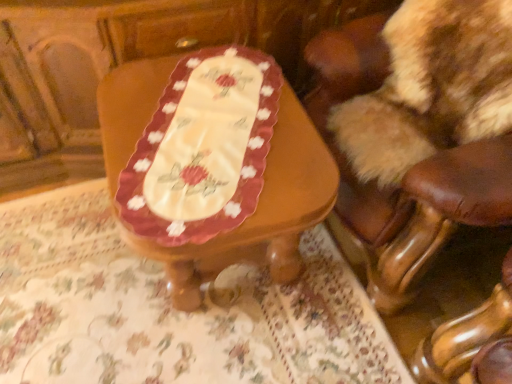
This screenshot has height=384, width=512. In order to click on wooden table at center in this screenshot , I will do `click(213, 165)`.

What do you see at coordinates (170, 309) in the screenshot?
I see `beige fabric tablecloth at center` at bounding box center [170, 309].

Identify the location of brown leather chair at upper right. [407, 119].

From the picture: From a real-world perspective, who is located higher, wooden table at center or brown leather chair at upper right?

brown leather chair at upper right.

From the image's perspective, is wooden table at center located beneath brown leather chair at upper right?

Yes, from the image's perspective, wooden table at center is beneath brown leather chair at upper right.

Consider the image. Is wooden table at center turned away from brown leather chair at upper right?

That's right, wooden table at center is facing away from brown leather chair at upper right.

Would you say wooden table at center is inside or outside brown leather chair at upper right?

wooden table at center lies outside brown leather chair at upper right.

Is wooden table at center facing away from beige fabric tablecloth at center?

No.

Is the depth of wooden table at center greater than that of beige fabric tablecloth at center?

No.

Is wooden table at center smaller than beige fabric tablecloth at center?

Incorrect, wooden table at center is not smaller in size than beige fabric tablecloth at center.

In the image, is brown leather chair at upper right on the left side or the right side of wooden table at center?

Based on their positions, brown leather chair at upper right is located to the right of wooden table at center.

From the image's perspective, which one is positioned lower, brown leather chair at upper right or wooden table at center?

wooden table at center appears lower in the image.

Is the position of brown leather chair at upper right less distant than that of wooden table at center?

Yes, it is.

Which is behind, point (385, 89) or point (154, 149)?

The point (385, 89) is more distant.

Is point (70, 240) closer or farther from the camera than point (439, 87)?

Point (70, 240) is positioned farther from the camera compared to point (439, 87).

Which object is further away from the camera taking this photo, beige fabric tablecloth at center or brown leather chair at upper right?

beige fabric tablecloth at center is further away from the camera.

Considering the sizes of objects beige fabric tablecloth at center and brown leather chair at upper right in the image provided, who is bigger, beige fabric tablecloth at center or brown leather chair at upper right?

With larger size is brown leather chair at upper right.

Is brown leather chair at upper right inside beige fabric tablecloth at center?

No.

Considering the relative sizes of beige fabric tablecloth at center and wooden table at center in the image provided, is beige fabric tablecloth at center shorter than wooden table at center?

Correct, beige fabric tablecloth at center is not as tall as wooden table at center.

Is beige fabric tablecloth at center behind wooden table at center?

Yes, beige fabric tablecloth at center is further from the camera.

Is beige fabric tablecloth at center not close to wooden table at center?

That's not correct — beige fabric tablecloth at center is a little close to wooden table at center.

Considering the sizes of beige fabric tablecloth at center and wooden table at center in the image, is beige fabric tablecloth at center wider or thinner than wooden table at center?

In the image, beige fabric tablecloth at center appears to be wider than wooden table at center.

Is brown leather chair at upper right smaller than beige fabric tablecloth at center?

Incorrect, brown leather chair at upper right is not smaller in size than beige fabric tablecloth at center.

Which object is closer to the camera, brown leather chair at upper right or beige fabric tablecloth at center?

brown leather chair at upper right is more forward.

From a real-world perspective, between brown leather chair at upper right and beige fabric tablecloth at center, who is vertically higher?

brown leather chair at upper right is physically above.

From the image's perspective, is brown leather chair at upper right located above or below beige fabric tablecloth at center?

brown leather chair at upper right is above beige fabric tablecloth at center.

In order to click on chair above the wooden table at center (from the image's perspective) in this screenshot , I will do `click(407, 119)`.

Locate an element on the screen. table in front of the beige fabric tablecloth at center is located at coordinates 213,165.

Considering their positions, is wooden table at center positioned closer to beige fabric tablecloth at center than brown leather chair at upper right?

wooden table at center is positioned closer to the anchor beige fabric tablecloth at center.

Looking at the image, which one is located closer to wooden table at center, beige fabric tablecloth at center or brown leather chair at upper right?

The object closer to wooden table at center is brown leather chair at upper right.

From the image, which object appears to be farther from brown leather chair at upper right, beige fabric tablecloth at center or wooden table at center?

beige fabric tablecloth at center lies further to brown leather chair at upper right than the other object.

Which object lies further to the anchor point wooden table at center, brown leather chair at upper right or beige fabric tablecloth at center?

beige fabric tablecloth at center lies further to wooden table at center than the other object.

Considering their positions, is wooden table at center positioned closer to brown leather chair at upper right than beige fabric tablecloth at center?

wooden table at center lies closer to brown leather chair at upper right than the other object.

When comparing their distances from beige fabric tablecloth at center, does brown leather chair at upper right or wooden table at center seem closer?

wooden table at center is closer to beige fabric tablecloth at center.

In order to click on tablecloth situated between wooden table at center and brown leather chair at upper right from left to right in this screenshot , I will do (170, 309).